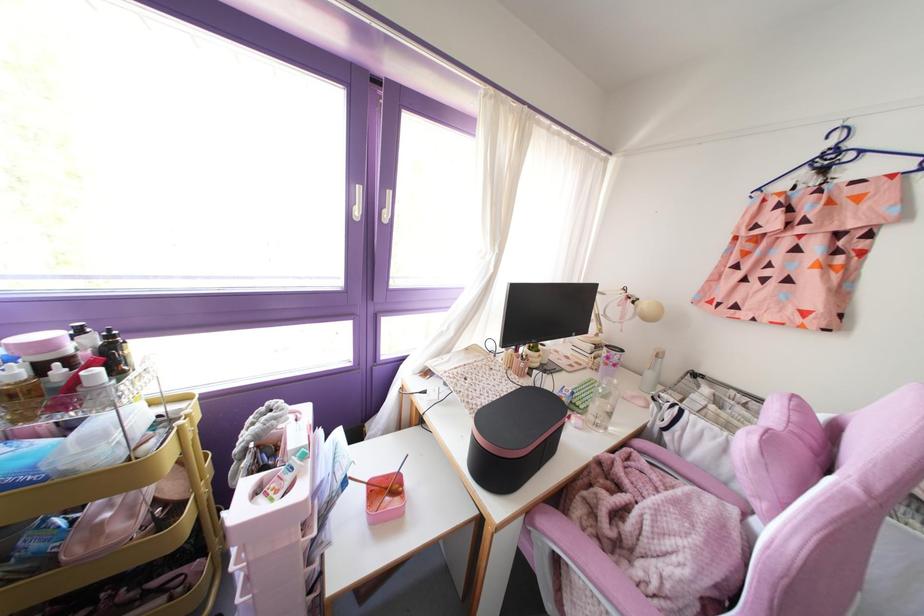
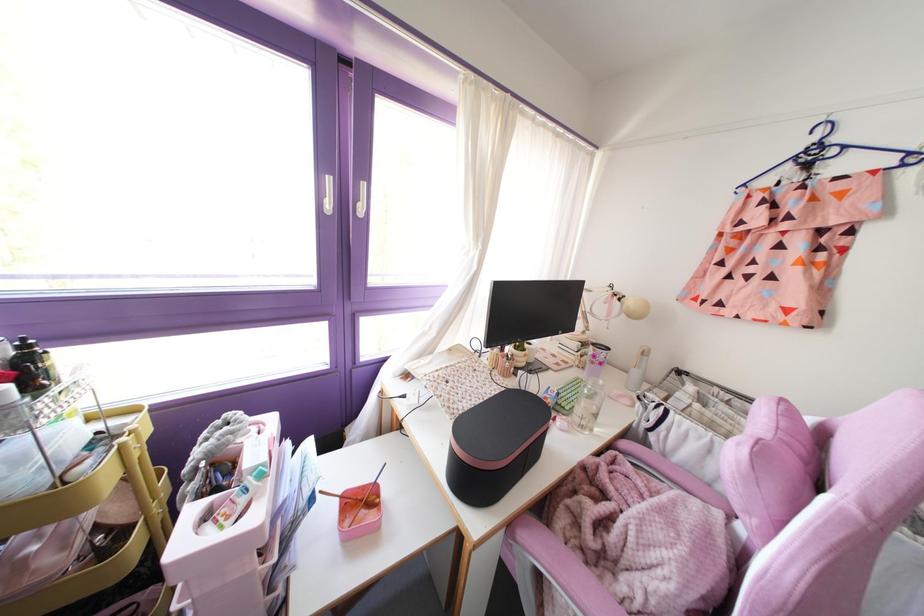
In the second image, find the point that corresponds to [744,514] in the first image.

(727, 517)